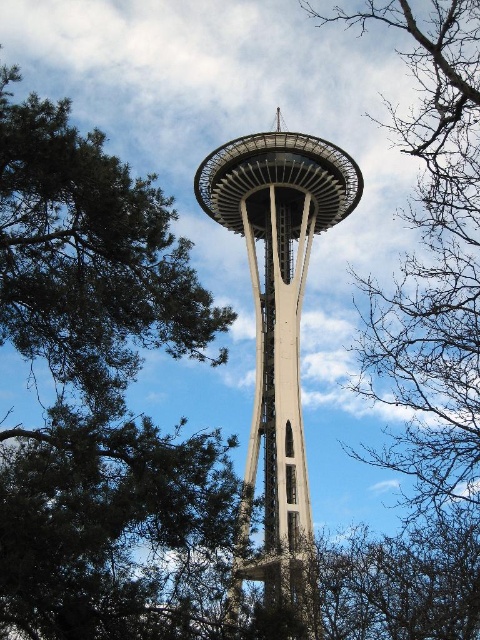
In the scene shown: Can you confirm if green leafy tree at upper left is smaller than concrete tower at center?

Yes.

Does point (61, 236) lie in front of point (304, 572)?

No, it is not.

The width and height of the screenshot is (480, 640). In order to click on green leafy tree at upper left in this screenshot , I will do `click(90, 253)`.

Is bare branches at center wider than concrete tower at center?

No.

Who is more distant from viewer, (x=447, y=163) or (x=300, y=211)?

The point (x=300, y=211) is more distant.

I want to click on bare branches at center, so click(x=432, y=310).

Which is more to the left, bare branches at center or green leafy tree at upper left?

green leafy tree at upper left

Is bare branches at center shorter than green leafy tree at upper left?

Incorrect, bare branches at center's height does not fall short of green leafy tree at upper left's.

This screenshot has height=640, width=480. In order to click on bare branches at center in this screenshot , I will do `click(432, 310)`.